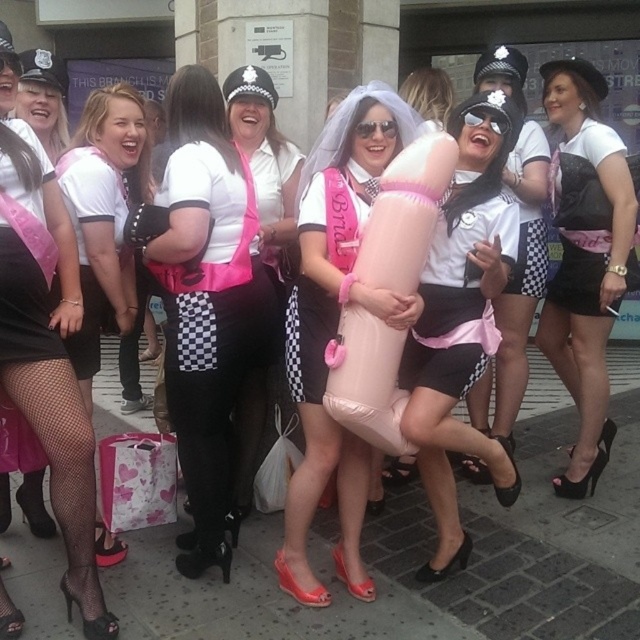
Which of these two, pink checkered pants at center or matte pink veil at center, stands shorter?

Standing shorter between the two is matte pink veil at center.

Is pink checkered pants at center wider than matte pink veil at center?

Yes.

You are a GUI agent. You are given a task and a screenshot of the screen. Output one action in this format:
    pyautogui.click(x=<x>, y=<y>)
    Task: Click on the pink checkered pants at center
    The image size is (640, 640).
    Given the screenshot: What is the action you would take?
    pyautogui.click(x=209, y=307)

Describe the element at coordinates (458, 300) in the screenshot. The height and width of the screenshot is (640, 640). I see `pink matte shorts at center` at that location.

Is pink matte shorts at center thinner than matte pink veil at center?

No.

Identify the location of pink matte shorts at center. (458, 300).

Is black leather skirt at center to the right of pink fabric bag at lower left from the viewer's perspective?

Yes, black leather skirt at center is to the right of pink fabric bag at lower left.

Measure the distance between point (604, 356) and camera.

The distance of point (604, 356) from camera is 2.98 meters.

You are a GUI agent. You are given a task and a screenshot of the screen. Output one action in this format:
    pyautogui.click(x=<x>, y=<y>)
    Task: Click on the black leather skirt at center
    
    Given the screenshot: What is the action you would take?
    pyautogui.click(x=586, y=257)